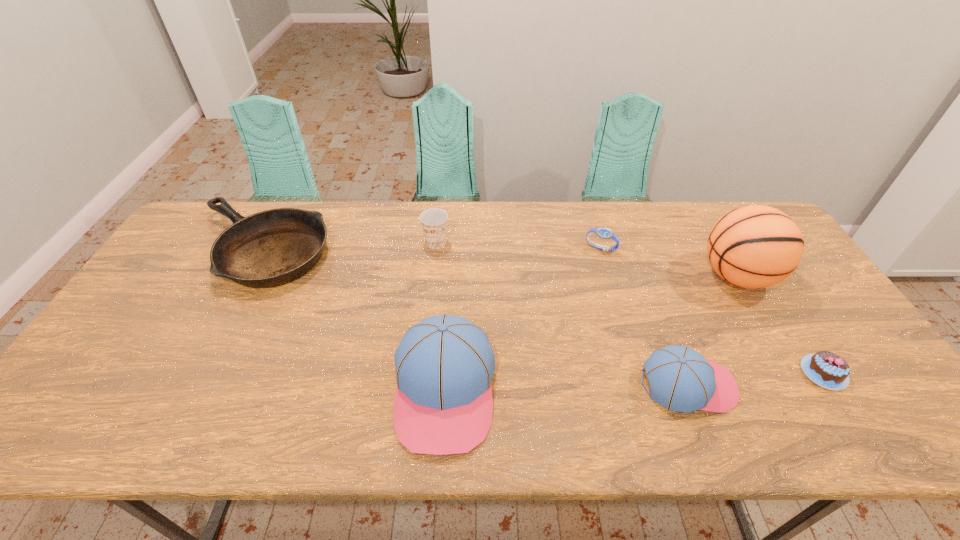
Identify the location of chocolate cake that is positioned at the right edge. (828, 370).

At what (x,y) coordinates should I click in order to perform the action: click on object located in the far left corner section of the desktop. Please return your answer as a coordinate pair (x, y). The image size is (960, 540). Looking at the image, I should click on (270, 248).

You are a GUI agent. You are given a task and a screenshot of the screen. Output one action in this format:
    pyautogui.click(x=<x>, y=<y>)
    Task: Click on the object at the near right corner
    
    Given the screenshot: What is the action you would take?
    pyautogui.click(x=828, y=370)

In the image, there is a desktop. At what (x,y) coordinates should I click in order to perform the action: click on free region at the far edge. Please return your answer as a coordinate pair (x, y). The image size is (960, 540). Looking at the image, I should click on (653, 226).

I want to click on vacant space at the right edge, so click(836, 324).

Locate an element on the screen. free space at the far right corner of the desktop is located at coordinates (712, 210).

Locate an element on the screen. blank region between the watch and the left baseball cap is located at coordinates (522, 319).

This screenshot has height=540, width=960. In order to click on free space between the shorter baseball cap and the Dixie cup in this screenshot , I will do `click(562, 314)`.

Where is `vacant area between the shorter baseball cap and the taller baseball cap`? This screenshot has width=960, height=540. vacant area between the shorter baseball cap and the taller baseball cap is located at coordinates (566, 387).

I want to click on free space that is in between the frying pan and the sixth shortest object, so click(x=353, y=319).